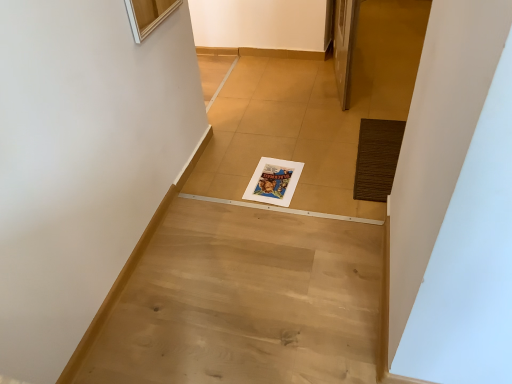
Question: In the image, is light wood floor at center positioned in front of or behind brown textured mat at right?

Choices:
 (A) front
 (B) behind

Answer: (A)

Question: Considering the positions of point (316, 307) and point (378, 160), is point (316, 307) closer or farther from the camera than point (378, 160)?

Choices:
 (A) closer
 (B) farther

Answer: (A)

Question: Which object is positioned closest to the white paper magazine at center?

Choices:
 (A) light wood floor at center
 (B) brown textured mat at right

Answer: (B)

Question: Estimate the real-world distances between objects in this image. Which object is farther from the brown textured mat at right?

Choices:
 (A) light wood floor at center
 (B) white paper magazine at center

Answer: (A)